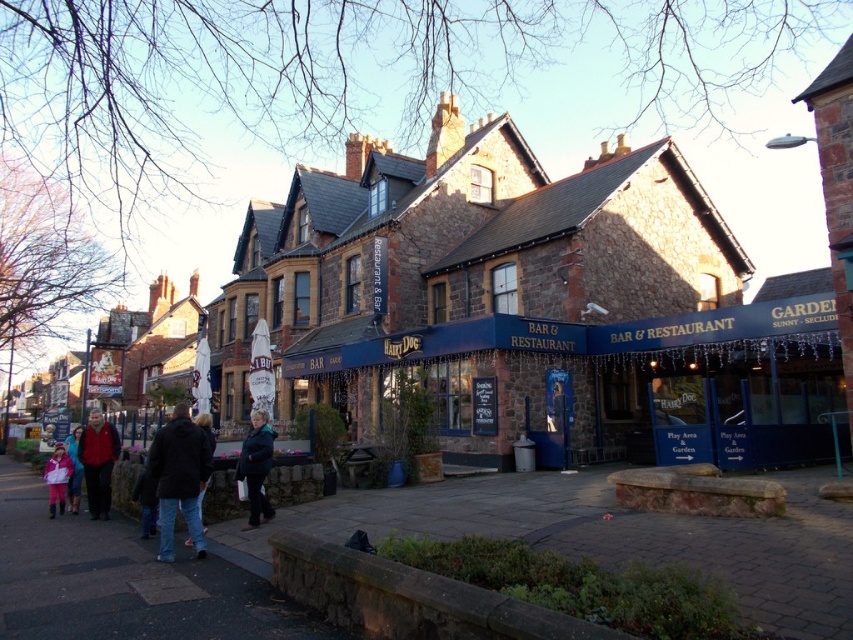
You are a tourist standing in front of the Hairy Dog establishment. You want to take a photo of both the stone building at center and the blue stone bar at center. Which one should you focus on first to ensure both are in frame?

The stone building at center is located above the blue stone bar at center, so you should focus on the blue stone bar at center first to ensure both are in frame.

You are a customer looking for a place to sit. You see the red wool coat at lower left and the light pink fabric at lower left. Which object is larger in size?

The red wool coat at lower left is bigger than the light pink fabric at lower left.

You are standing at the entrance of the Hairy Dog bar and restaurant. You notice a red wool coat at lower left. Where exactly is the red wool coat located in relation to the entrance?

The red wool coat at lower left is located at point (97, 461) relative to the entrance of the Hairy Dog bar and restaurant.